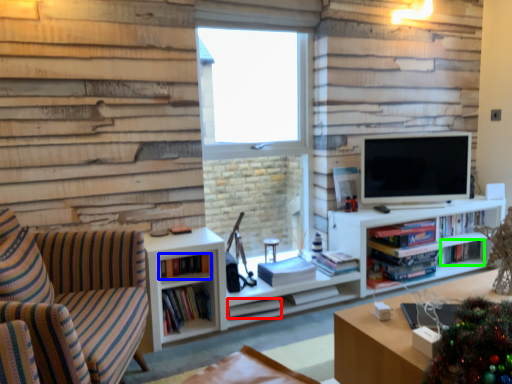
Question: Based on their relative distances, which object is nearer to book (highlighted by a red box)? Choose from book (highlighted by a blue box) and book (highlighted by a green box).

Choices:
 (A) book
 (B) book

Answer: (A)